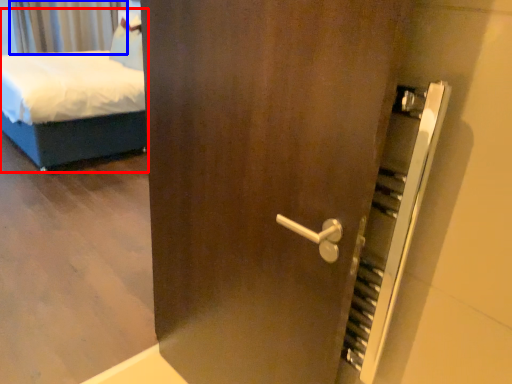
Question: Which of the following is the farthest to the observer, bed (highlighted by a red box) or curtain (highlighted by a blue box)?

Choices:
 (A) bed
 (B) curtain

Answer: (B)